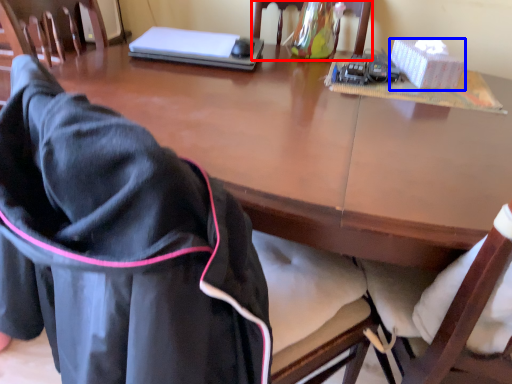
Question: Which point is further to the camera, chair (highlighted by a red box) or box (highlighted by a blue box)?

Choices:
 (A) chair
 (B) box

Answer: (B)